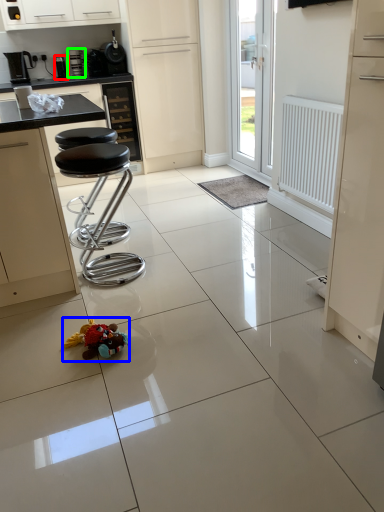
Question: Estimate the real-world distances between objects in this image. Which object is closer to appliance (highlighted by a red box), toy (highlighted by a blue box) or coffee machine (highlighted by a green box)?

Choices:
 (A) toy
 (B) coffee machine

Answer: (B)